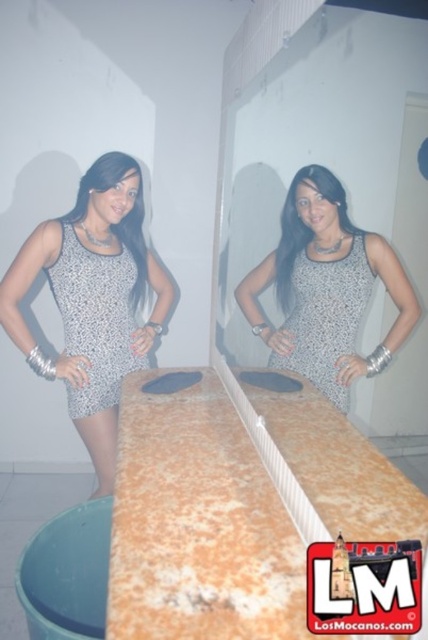
Describe the element at coordinates (237, 508) in the screenshot. The image size is (428, 640). I see `orange marble countertop at center` at that location.

Is orange marble countertop at center above speckled fabric dress at center?

Incorrect, orange marble countertop at center is not positioned above speckled fabric dress at center.

Measure the distance between orange marble countertop at center and camera.

orange marble countertop at center and camera are 25.36 inches apart from each other.

The image size is (428, 640). I want to click on orange marble countertop at center, so (237, 508).

Does matte silver dress at center have a lesser height compared to silver metallic dress at center?

Correct, matte silver dress at center is not as tall as silver metallic dress at center.

Does matte silver dress at center appear on the left side of silver metallic dress at center?

In fact, matte silver dress at center is to the right of silver metallic dress at center.

You are a GUI agent. You are given a task and a screenshot of the screen. Output one action in this format:
    pyautogui.click(x=<x>, y=<y>)
    Task: Click on the matte silver dress at center
    
    Given the screenshot: What is the action you would take?
    coord(326,289)

Which is in front, point (89, 369) or point (327, 356)?

Positioned in front is point (327, 356).

Looking at this image, does silver metallic dress at center have a greater width compared to gray dotted dress at center?

Indeed, silver metallic dress at center has a greater width compared to gray dotted dress at center.

Which is behind, point (134, 264) or point (353, 340)?

The point (134, 264) is behind.

Identify the location of silver metallic dress at center. (95, 320).